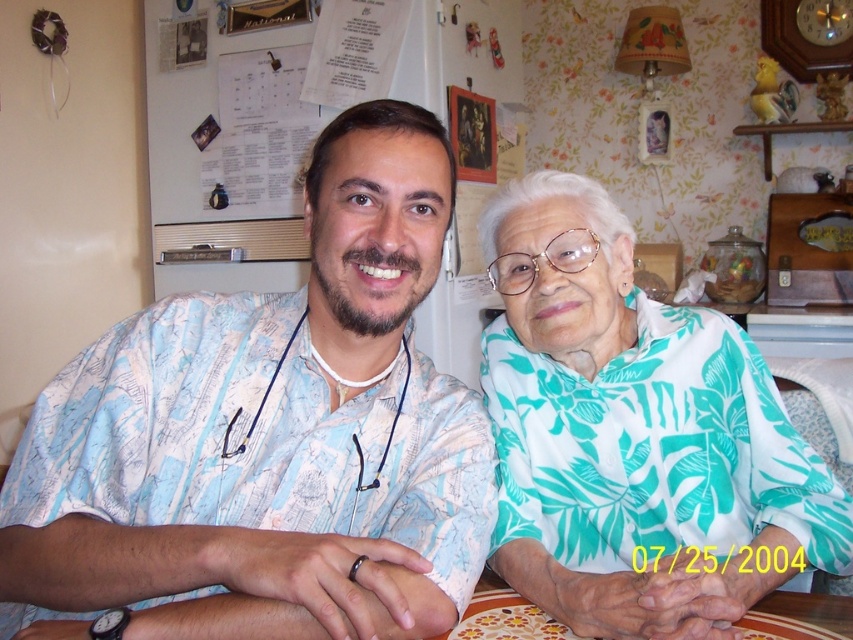
Question: Is white printed shirt at center above teal leaf-patterned blouse at center-right?

Choices:
 (A) no
 (B) yes

Answer: (A)

Question: Which point is closer to the camera?

Choices:
 (A) white printed shirt at center
 (B) teal leaf-patterned blouse at center-right
 (C) floral-patterned table at center

Answer: (A)

Question: Does teal leaf-patterned blouse at center-right appear on the left side of floral-patterned table at center?

Choices:
 (A) no
 (B) yes

Answer: (A)

Question: Which point is closer to the camera?

Choices:
 (A) (560, 316)
 (B) (805, 598)

Answer: (B)

Question: Can you confirm if white printed shirt at center is bigger than floral-patterned table at center?

Choices:
 (A) no
 (B) yes

Answer: (B)

Question: Which object is the farthest from the teal leaf-patterned blouse at center-right?

Choices:
 (A) floral-patterned table at center
 (B) white printed shirt at center

Answer: (B)